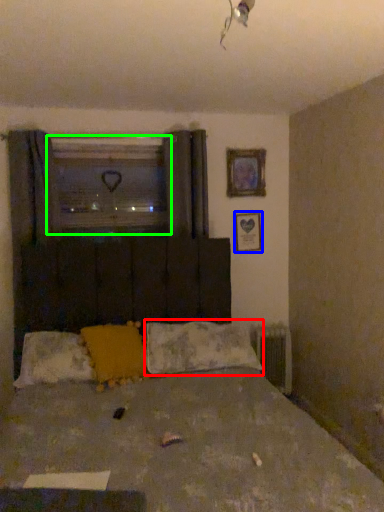
Question: Which object is the closest to the pillow (highlighted by a red box)? Choose among these: picture frame (highlighted by a blue box) or window screen (highlighted by a green box).

Choices:
 (A) picture frame
 (B) window screen

Answer: (A)